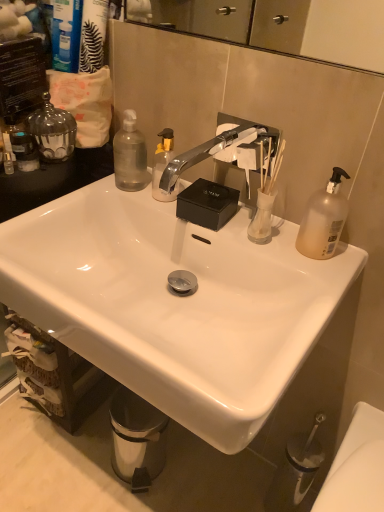
I want to click on vacant space in stainless steel trash can at lower left (from a real-world perspective), so click(135, 464).